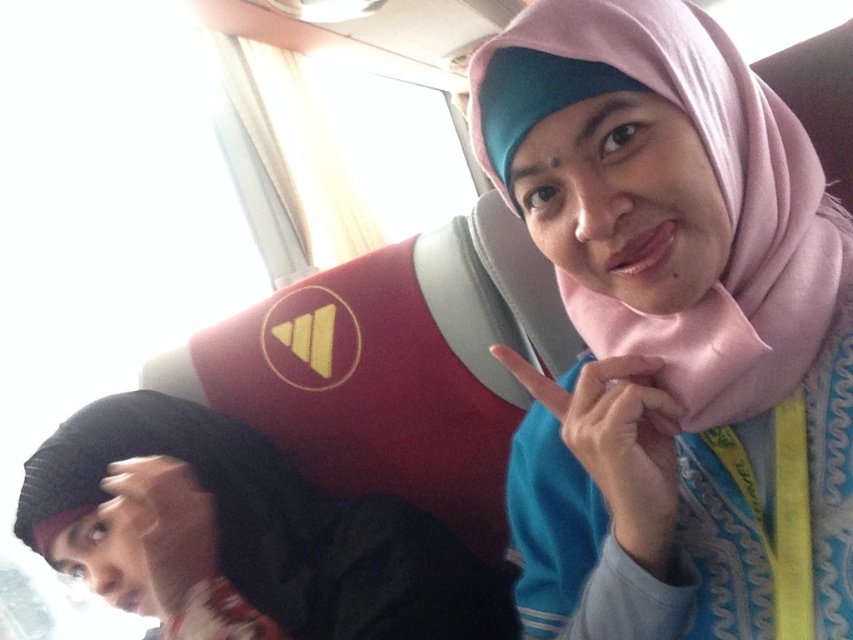
Question: Is pink fabric hijab at upper right to the left of black fabric at lower left from the viewer's perspective?

Choices:
 (A) no
 (B) yes

Answer: (A)

Question: Does pink fabric hijab at upper right come behind black fabric at lower left?

Choices:
 (A) no
 (B) yes

Answer: (A)

Question: Which point is farther to the camera?

Choices:
 (A) black fabric at lower left
 (B) pink fabric hijab at upper right

Answer: (A)

Question: Which point appears closest to the camera in this image?

Choices:
 (A) (634, 35)
 (B) (392, 570)

Answer: (A)

Question: Does pink fabric hijab at upper right come in front of black fabric at lower left?

Choices:
 (A) no
 (B) yes

Answer: (B)